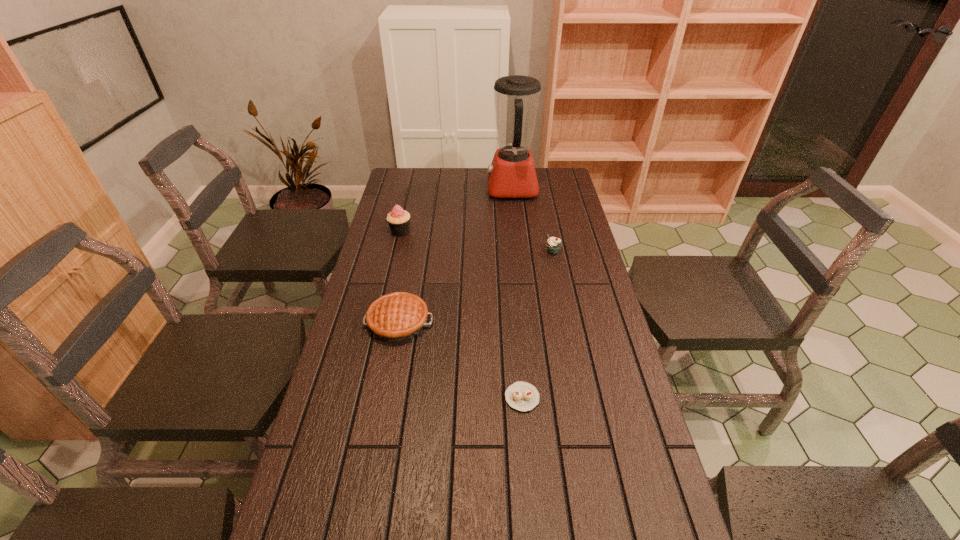
Image resolution: width=960 pixels, height=540 pixels. I want to click on blank space located on the front of the blender near the controls, so click(446, 189).

The image size is (960, 540). What are the coordinates of `vacant space located 0.170m on the front of the blender near the controls` in the screenshot? It's located at (446, 189).

Find the location of a particular element. vacant area situated 0.310m on the front of the second tallest object is located at coordinates (385, 297).

Where is `vacant point located 0.300m on the front of the third nearest object`? The image size is (960, 540). vacant point located 0.300m on the front of the third nearest object is located at coordinates (566, 320).

You are a GUI agent. You are given a task and a screenshot of the screen. Output one action in this format:
    pyautogui.click(x=<x>, y=<y>)
    Task: Click on the free space located 0.300m on the right of the pie
    This screenshot has height=540, width=960.
    Given the screenshot: What is the action you would take?
    point(536,322)

The width and height of the screenshot is (960, 540). Find the location of `blank space located 0.390m on the left of the shortest cupcake`. blank space located 0.390m on the left of the shortest cupcake is located at coordinates (349, 397).

The width and height of the screenshot is (960, 540). I want to click on object that is at the far edge, so click(512, 174).

Find the location of a particular element. cupcake positioned at the left edge is located at coordinates (398, 219).

Where is `pie that is at the left edge`? pie that is at the left edge is located at coordinates (400, 316).

This screenshot has height=540, width=960. In order to click on blender situated at the right edge in this screenshot , I will do `click(512, 174)`.